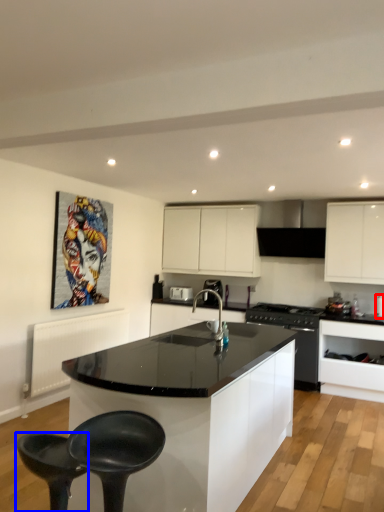
Question: Which point is further to the camera, appliance (highlighted by a red box) or bar stool (highlighted by a blue box)?

Choices:
 (A) appliance
 (B) bar stool

Answer: (A)